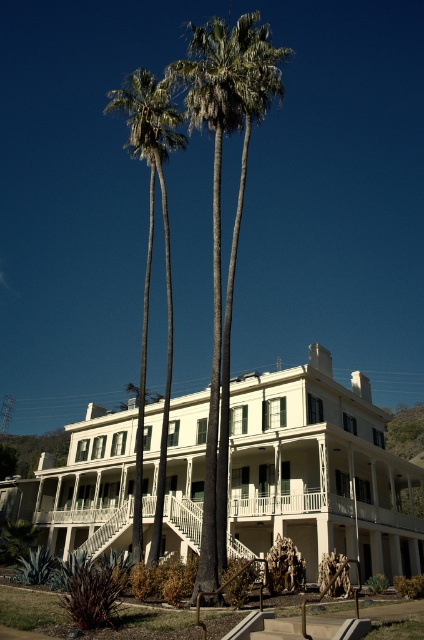
You are standing at the point marked as point (220, 218). What can you see directly in front of you?

At point (220, 218), you can see a green leafy palm tree at center directly in front of you.

In the scene shown: You are standing in front of the grand building and notice two green leafy palms. One is labeled as the green leafy palm tree at center and the other as the green leafy palm at center. According to the description, which one is positioned higher relative to the other?

The green leafy palm tree at center is located above the green leafy palm at center.